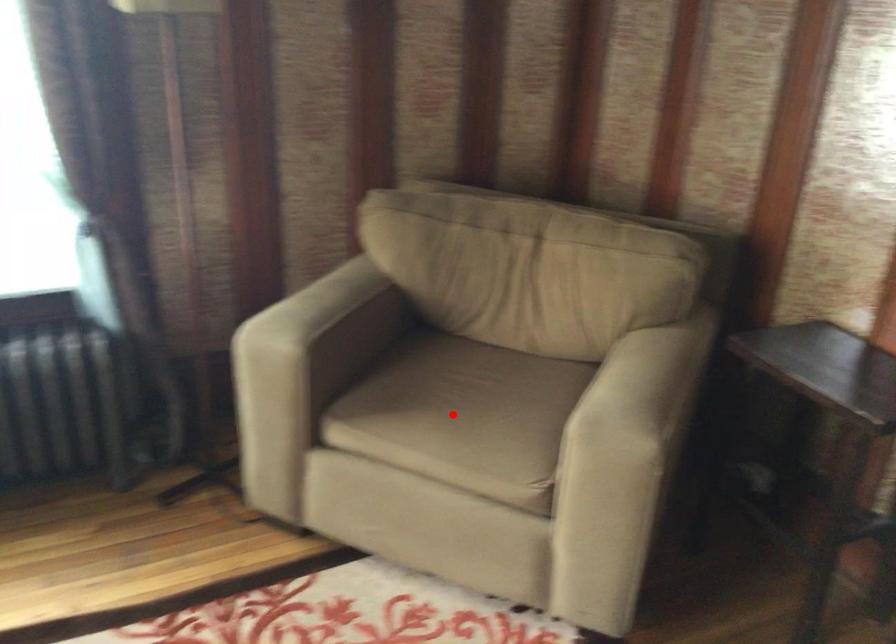
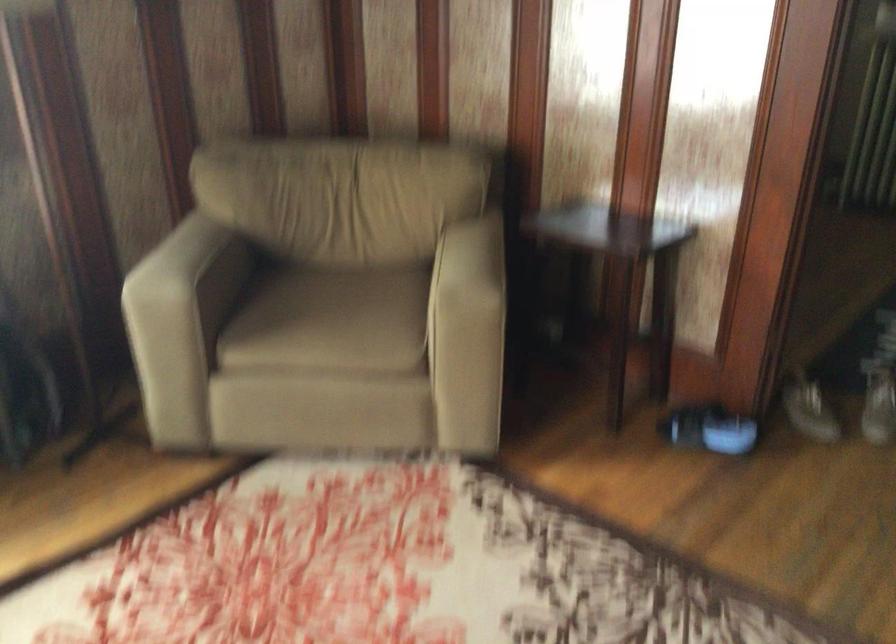
Question: I am providing you with two images of the same scene from different viewpoints. A red point is shown in image1. For the corresponding object point in image2, is it positioned nearer or farther from the camera?

Choices:
 (A) Nearer
 (B) Farther

Answer: (B)